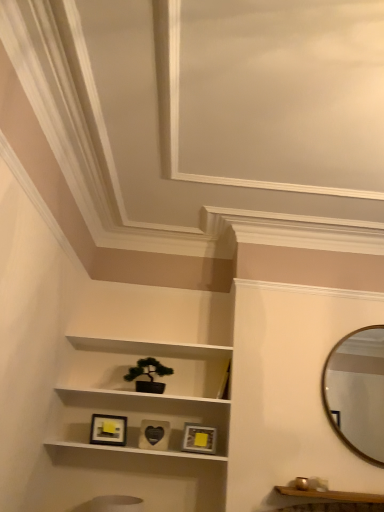
What do you see at coordinates (154, 435) in the screenshot?
I see `black matte heart at center, which is counted as the second picture frame, starting from the right` at bounding box center [154, 435].

At what (x,y) coordinates should I click in order to perform the action: click on gold metallic mirror at upper right. Please return your answer as a coordinate pair (x, y). Looking at the image, I should click on (357, 391).

The width and height of the screenshot is (384, 512). I want to click on matte black picture frame at lower center, which is counted as the first picture frame, starting from the left, so click(x=108, y=430).

What do you see at coordinates (108, 430) in the screenshot? I see `matte black picture frame at lower center, which is counted as the first picture frame, starting from the left` at bounding box center [108, 430].

This screenshot has width=384, height=512. Describe the element at coordinates (148, 375) in the screenshot. I see `green matte houseplant at center` at that location.

Identify the location of black matte heart at center, which is counted as the second picture frame, starting from the right. The width and height of the screenshot is (384, 512). (154, 435).

Is matte black picture frame at lower center, which is counted as the first picture frame, starting from the left, far from wooden shelf at lower right?

Absolutely, matte black picture frame at lower center, which is counted as the first picture frame, starting from the left, is distant from wooden shelf at lower right.

From a real-world perspective, between matte black picture frame at lower center, marked as the 3th picture frame in a right-to-left arrangement, and wooden shelf at lower right, who is vertically lower?

wooden shelf at lower right is physically lower.

Who is bigger, matte black picture frame at lower center, which is counted as the first picture frame, starting from the left, or wooden shelf at lower right?

wooden shelf at lower right is bigger.

Is matte black picture frame at lower center, which is counted as the first picture frame, starting from the left, behind wooden shelf at lower right?

Yes.

Based on the photo, is matte gold picture frame at center, positioned as the first picture frame in right-to-left order, turned away from wooden shelf at lower right?

No, matte gold picture frame at center, positioned as the first picture frame in right-to-left order,'s orientation is not away from wooden shelf at lower right.

From a real-world perspective, is matte gold picture frame at center, positioned as the first picture frame in right-to-left order, physically located above or below wooden shelf at lower right?

Clearly, from a real-world perspective, matte gold picture frame at center, positioned as the first picture frame in right-to-left order, is above wooden shelf at lower right.

Considering the relative sizes of matte gold picture frame at center, positioned as the first picture frame in right-to-left order, and wooden shelf at lower right in the image provided, is matte gold picture frame at center, positioned as the first picture frame in right-to-left order, bigger than wooden shelf at lower right?

Yes, matte gold picture frame at center, positioned as the first picture frame in right-to-left order, is bigger than wooden shelf at lower right.

Is matte gold picture frame at center, which is counted as the 3th picture frame, starting from the left, at the right side of wooden shelf at lower right?

No, matte gold picture frame at center, which is counted as the 3th picture frame, starting from the left, is not to the right of wooden shelf at lower right.

Considering the relative sizes of gold metallic mirror at upper right and white matte shelf at center in the image provided, is gold metallic mirror at upper right wider than white matte shelf at center?

In fact, gold metallic mirror at upper right might be narrower than white matte shelf at center.

The image size is (384, 512). Find the location of `mirror lying on the right of white matte shelf at center`. mirror lying on the right of white matte shelf at center is located at coordinates (357, 391).

Is white matte shelf at center at the back of gold metallic mirror at upper right?

gold metallic mirror at upper right does not have its back to white matte shelf at center.

Based on the photo, is gold metallic mirror at upper right situated inside white matte shelf at center or outside?

gold metallic mirror at upper right is located beyond the bounds of white matte shelf at center.

Is gold metallic mirror at upper right situated inside wooden shelf at lower right or outside?

gold metallic mirror at upper right cannot be found inside wooden shelf at lower right.

From a real-world perspective, between gold metallic mirror at upper right and wooden shelf at lower right, who is vertically lower?

wooden shelf at lower right.

Identify the location of mirror behind the wooden shelf at lower right. (357, 391).

Considering the relative positions of gold metallic mirror at upper right and wooden shelf at lower right in the image provided, is gold metallic mirror at upper right behind wooden shelf at lower right?

Yes.

This screenshot has width=384, height=512. There is a matte gold picture frame at center, positioned as the first picture frame in right-to-left order. Find the location of `the 1st picture frame above it (from a real-world perspective)`. the 1st picture frame above it (from a real-world perspective) is located at coordinates (108, 430).

Which of these two, matte black picture frame at lower center, which is counted as the first picture frame, starting from the left, or matte gold picture frame at center, positioned as the first picture frame in right-to-left order, stands shorter?

Standing shorter between the two is matte gold picture frame at center, positioned as the first picture frame in right-to-left order.

From a real-world perspective, is matte black picture frame at lower center, which is counted as the first picture frame, starting from the left, physically above matte gold picture frame at center, positioned as the first picture frame in right-to-left order?

Indeed, from a real-world perspective, matte black picture frame at lower center, which is counted as the first picture frame, starting from the left, stands above matte gold picture frame at center, positioned as the first picture frame in right-to-left order.

Can matte gold picture frame at center, which is counted as the 3th picture frame, starting from the left, be found inside matte black picture frame at lower center, marked as the 3th picture frame in a right-to-left arrangement?

No, matte gold picture frame at center, which is counted as the 3th picture frame, starting from the left, is located outside of matte black picture frame at lower center, marked as the 3th picture frame in a right-to-left arrangement.

Does matte gold picture frame at center, which is counted as the 3th picture frame, starting from the left, touch gold metallic mirror at upper right?

matte gold picture frame at center, which is counted as the 3th picture frame, starting from the left, and gold metallic mirror at upper right are clearly separated.

Is matte gold picture frame at center, positioned as the first picture frame in right-to-left order, closer to camera compared to gold metallic mirror at upper right?

No, it is behind gold metallic mirror at upper right.

Is matte gold picture frame at center, which is counted as the 3th picture frame, starting from the left, taller or shorter than gold metallic mirror at upper right?

Considering their sizes, matte gold picture frame at center, which is counted as the 3th picture frame, starting from the left, has less height than gold metallic mirror at upper right.

From the picture: From the image's perspective, is matte gold picture frame at center, positioned as the first picture frame in right-to-left order, located above or below gold metallic mirror at upper right?

matte gold picture frame at center, positioned as the first picture frame in right-to-left order, is below gold metallic mirror at upper right.

Considering the sizes of objects gold metallic mirror at upper right and matte gold picture frame at center, which is counted as the 3th picture frame, starting from the left, in the image provided, who is smaller, gold metallic mirror at upper right or matte gold picture frame at center, which is counted as the 3th picture frame, starting from the left,?

With smaller size is matte gold picture frame at center, which is counted as the 3th picture frame, starting from the left.

Is gold metallic mirror at upper right far from matte gold picture frame at center, positioned as the first picture frame in right-to-left order?

gold metallic mirror at upper right is near matte gold picture frame at center, positioned as the first picture frame in right-to-left order, not far away.

How much distance is there between gold metallic mirror at upper right and matte gold picture frame at center, positioned as the first picture frame in right-to-left order?

gold metallic mirror at upper right is 35.04 inches from matte gold picture frame at center, positioned as the first picture frame in right-to-left order.

Does gold metallic mirror at upper right have a greater width compared to matte gold picture frame at center, positioned as the first picture frame in right-to-left order?

Incorrect, the width of gold metallic mirror at upper right does not surpass that of matte gold picture frame at center, positioned as the first picture frame in right-to-left order.

This screenshot has width=384, height=512. I want to click on picture frame that is the 1st one when counting backward from the wooden shelf at lower right, so click(x=108, y=430).

The image size is (384, 512). In the image, there is a matte gold picture frame at center, positioned as the first picture frame in right-to-left order. What are the coordinates of `cabinetry below it (from a real-world perspective)` in the screenshot? It's located at (331, 495).

Estimate the real-world distances between objects in this image. Which object is closer to wooden shelf at lower right, matte black picture frame at lower center, which is counted as the first picture frame, starting from the left, or gold metallic mirror at upper right?

Among the two, gold metallic mirror at upper right is located nearer to wooden shelf at lower right.

Estimate the real-world distances between objects in this image. Which object is closer to matte gold picture frame at center, which is counted as the 3th picture frame, starting from the left, gold metallic mirror at upper right or wooden shelf at lower right?

Among the two, wooden shelf at lower right is located nearer to matte gold picture frame at center, which is counted as the 3th picture frame, starting from the left.

When comparing their distances from black matte heart at center, which is counted as the second picture frame, starting from the right, does gold metallic mirror at upper right or green matte houseplant at center seem closer?

Based on the image, green matte houseplant at center appears to be nearer to black matte heart at center, which is counted as the second picture frame, starting from the right.

Based on the photo, when comparing their distances from green matte houseplant at center, does matte black picture frame at lower center, marked as the 3th picture frame in a right-to-left arrangement, or black matte heart at center, which is counted as the second picture frame, starting from the right, seem further?

Among the two, matte black picture frame at lower center, marked as the 3th picture frame in a right-to-left arrangement, is located further to green matte houseplant at center.

Looking at this image, looking at the image, which one is located further to gold metallic mirror at upper right, black matte heart at center, the second picture frame viewed from the left, or white matte shelf at center?

black matte heart at center, the second picture frame viewed from the left.

Estimate the real-world distances between objects in this image. Which object is further from black matte heart at center, the second picture frame viewed from the left, green matte houseplant at center or wooden shelf at lower right?

The object further to black matte heart at center, the second picture frame viewed from the left, is wooden shelf at lower right.

Looking at the image, which one is located closer to matte black picture frame at lower center, which is counted as the first picture frame, starting from the left, gold metallic mirror at upper right or green matte houseplant at center?

Among the two, green matte houseplant at center is located nearer to matte black picture frame at lower center, which is counted as the first picture frame, starting from the left.

When comparing their distances from white matte shelf at center, does black matte heart at center, the second picture frame viewed from the left, or matte black picture frame at lower center, which is counted as the first picture frame, starting from the left, seem further?

matte black picture frame at lower center, which is counted as the first picture frame, starting from the left, is further to white matte shelf at center.

This screenshot has height=512, width=384. I want to click on houseplant between matte black picture frame at lower center, marked as the 3th picture frame in a right-to-left arrangement, and wooden shelf at lower right from left to right, so click(148, 375).

The width and height of the screenshot is (384, 512). What are the coordinates of `houseplant between matte black picture frame at lower center, which is counted as the first picture frame, starting from the left, and matte gold picture frame at center, positioned as the first picture frame in right-to-left order, from left to right` in the screenshot? It's located at pos(148,375).

You are a GUI agent. You are given a task and a screenshot of the screen. Output one action in this format:
    pyautogui.click(x=<x>, y=<y>)
    Task: Click on the picture frame situated between black matte heart at center, which is counted as the second picture frame, starting from the right, and wooden shelf at lower right from left to right
    This screenshot has width=384, height=512.
    Given the screenshot: What is the action you would take?
    pyautogui.click(x=199, y=439)

The height and width of the screenshot is (512, 384). I want to click on cabinetry between white matte shelf at center and gold metallic mirror at upper right from left to right, so click(x=331, y=495).